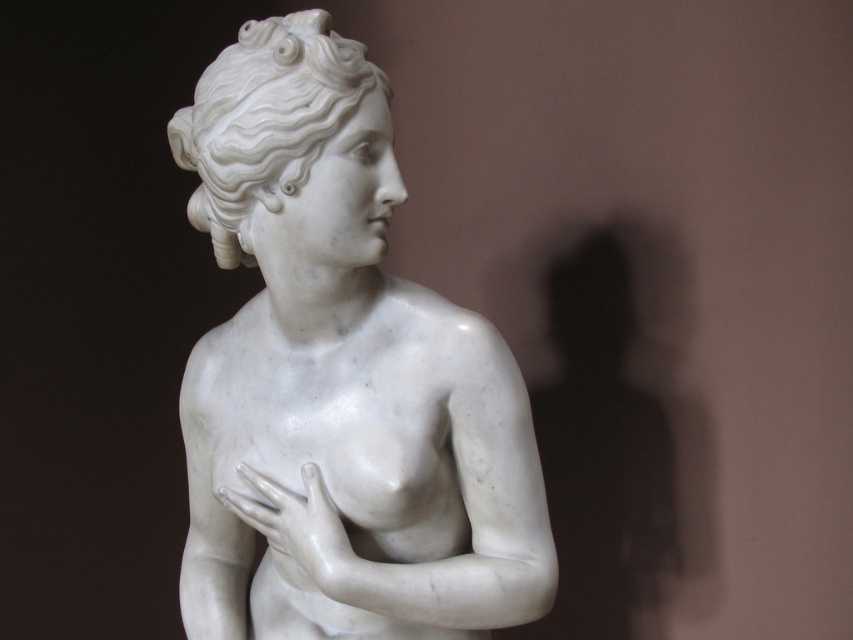
Question: Which of the following is the farthest from the observer?

Choices:
 (A) white marble statue at center
 (B) white marble hand at center

Answer: (B)

Question: Does white marble statue at center have a greater width compared to white marble hand at center?

Choices:
 (A) no
 (B) yes

Answer: (B)

Question: Can you confirm if white marble statue at center is positioned below white marble hand at center?

Choices:
 (A) yes
 (B) no

Answer: (B)

Question: Is the position of white marble statue at center more distant than that of white marble hand at center?

Choices:
 (A) no
 (B) yes

Answer: (A)